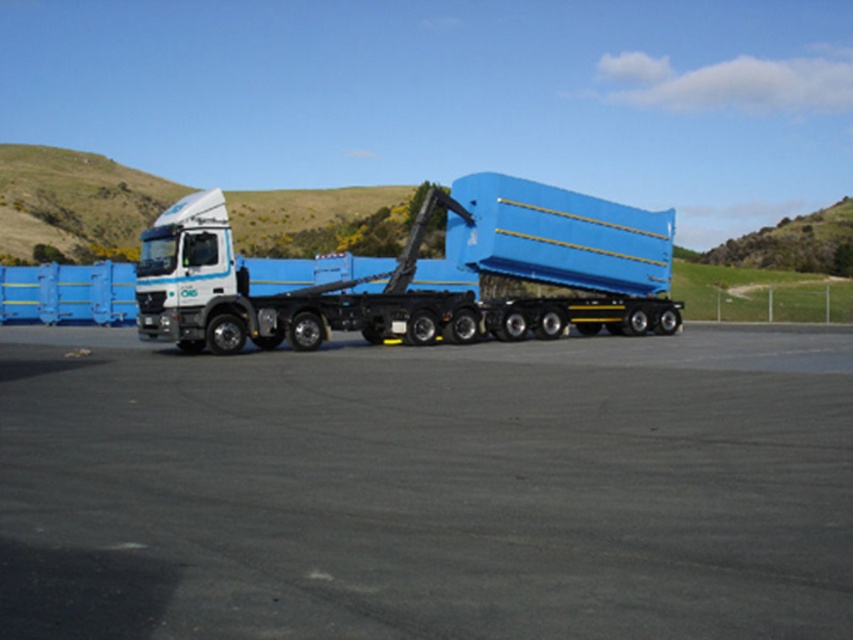
Based on the photo, you are a delivery driver who needs to park your matte blue truck at center in a parking spot. The parking spot is the size of the black asphalt at center. Based on the scene, will your truck fit in the parking spot?

The black asphalt at center has a smaller size compared to matte blue truck at center. Therefore, the matte blue truck at center will not fit in the parking spot as the asphalt area is too small.